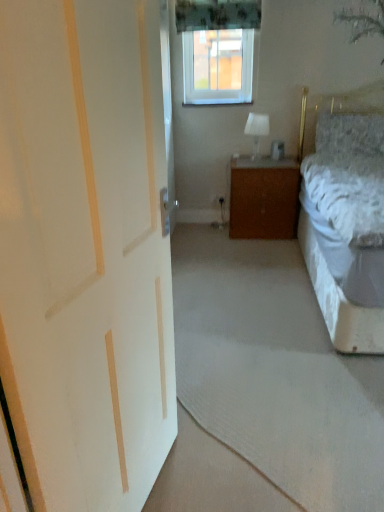
Describe the element at coordinates (217, 14) in the screenshot. This screenshot has width=384, height=512. I see `green floral fabric curtain at upper center` at that location.

Where is `wooden cabinet at center`? wooden cabinet at center is located at coordinates (264, 198).

How many degrees apart are the facing directions of white painted wood door at left and wooden cabinet at center?

They differ by 75.7 degrees in their facing directions.

Choose the correct answer: Is white painted wood door at left inside wooden cabinet at center or outside it?

white painted wood door at left is located beyond the bounds of wooden cabinet at center.

From a real-world perspective, which object stands above the other?

white painted wood door at left is physically above.

How distant is white painted wood door at left from wooden cabinet at center?

white painted wood door at left is 7.90 feet from wooden cabinet at center.

From the image's perspective, relative to white fabric lampshade at upper center, is fluffy gray pillow at upper right above or below?

fluffy gray pillow at upper right is above white fabric lampshade at upper center.

Is fluffy gray pillow at upper right not inside white fabric lampshade at upper center?

fluffy gray pillow at upper right is positioned outside white fabric lampshade at upper center.

Where is `pillow in front of the white fabric lampshade at upper center`? Image resolution: width=384 pixels, height=512 pixels. pillow in front of the white fabric lampshade at upper center is located at coordinates (350, 134).

From a real-world perspective, is fluffy gray pillow at upper right beneath white fabric lampshade at upper center?

No, from a real-world perspective, fluffy gray pillow at upper right is not beneath white fabric lampshade at upper center.

Is fluffy gray pillow at upper right to the right of green floral fabric curtain at upper center from the viewer's perspective?

Yes, fluffy gray pillow at upper right is to the right of green floral fabric curtain at upper center.

From a real-world perspective, is fluffy gray pillow at upper right located beneath green floral fabric curtain at upper center?

Correct, in the physical world, fluffy gray pillow at upper right is lower than green floral fabric curtain at upper center.

The height and width of the screenshot is (512, 384). In the image, there is a green floral fabric curtain at upper center. What are the coordinates of `pillow below it (from a real-world perspective)` in the screenshot? It's located at (350, 134).

How many degrees apart are the facing directions of white painted wood door at left and green floral fabric curtain at upper center?

The angular difference between white painted wood door at left and green floral fabric curtain at upper center is 74.9 degrees.

I want to click on door below the green floral fabric curtain at upper center (from a real-world perspective), so click(x=85, y=250).

Considering the sizes of objects white painted wood door at left and green floral fabric curtain at upper center in the image provided, who is taller, white painted wood door at left or green floral fabric curtain at upper center?

white painted wood door at left.

Considering the relative sizes of white painted wood door at left and green floral fabric curtain at upper center in the image provided, is white painted wood door at left wider than green floral fabric curtain at upper center?

Yes.

Is fluffy gray pillow at upper right touching wooden cabinet at center?

fluffy gray pillow at upper right and wooden cabinet at center are clearly separated.

From a real-world perspective, between fluffy gray pillow at upper right and wooden cabinet at center, who is vertically higher?

fluffy gray pillow at upper right.

Which object is wider, fluffy gray pillow at upper right or wooden cabinet at center?

wooden cabinet at center is wider.

Which of these two, fluffy gray pillow at upper right or wooden cabinet at center, stands shorter?

fluffy gray pillow at upper right.

Can you confirm if white fabric lampshade at upper center is taller than clear plastic window screen at upper center?

Incorrect, the height of white fabric lampshade at upper center is not larger of that of clear plastic window screen at upper center.

Does white fabric lampshade at upper center contain clear plastic window screen at upper center?

No, clear plastic window screen at upper center is not surrounded by white fabric lampshade at upper center.

Looking at the image, does white fabric lampshade at upper center seem bigger or smaller compared to clear plastic window screen at upper center?

Clearly, white fabric lampshade at upper center is smaller in size than clear plastic window screen at upper center.

In the scene shown: From the image's perspective, is white fabric lampshade at upper center above clear plastic window screen at upper center?

Actually, white fabric lampshade at upper center appears below clear plastic window screen at upper center in the image.

Is wooden cabinet at center at the left side of clear plastic window screen at upper center?

No, wooden cabinet at center is not to the left of clear plastic window screen at upper center.

Is point (284, 207) behind point (221, 77)?

No, (284, 207) is in front of (221, 77).

Is clear plastic window screen at upper center a part of wooden cabinet at center?

No, clear plastic window screen at upper center is not inside wooden cabinet at center.

In order to click on door on the left of wooden cabinet at center in this screenshot , I will do `click(85, 250)`.

This screenshot has height=512, width=384. Identify the location of lamp lying behind the fluffy gray pillow at upper right. (257, 130).

Looking at the image, which one is located further to white fabric lampshade at upper center, white painted wood door at left or wooden cabinet at center?

Among the two, white painted wood door at left is located further to white fabric lampshade at upper center.

Estimate the real-world distances between objects in this image. Which object is closer to fluffy gray pillow at upper right, green floral fabric curtain at upper center or wooden cabinet at center?

Among the two, wooden cabinet at center is located nearer to fluffy gray pillow at upper right.

Considering their positions, is white painted wood door at left positioned further to green floral fabric curtain at upper center than wooden cabinet at center?

white painted wood door at left lies further to green floral fabric curtain at upper center than the other object.

Looking at the image, which one is located further to white painted wood door at left, clear plastic window screen at upper center or fluffy gray pillow at upper right?

clear plastic window screen at upper center is positioned further to the anchor white painted wood door at left.

Considering their positions, is white painted wood door at left positioned further to green floral fabric curtain at upper center than white fabric lampshade at upper center?

white painted wood door at left is positioned further to the anchor green floral fabric curtain at upper center.

Based on their spatial positions, is white fabric lampshade at upper center or white painted wood door at left closer to green floral fabric curtain at upper center?

white fabric lampshade at upper center is positioned closer to the anchor green floral fabric curtain at upper center.

Which object lies further to the anchor point white painted wood door at left, wooden cabinet at center or white fabric lampshade at upper center?

white fabric lampshade at upper center is positioned further to the anchor white painted wood door at left.

Looking at the image, which one is located closer to clear plastic window screen at upper center, wooden cabinet at center or fluffy gray pillow at upper right?

fluffy gray pillow at upper right lies closer to clear plastic window screen at upper center than the other object.

Identify the location of pillow between green floral fabric curtain at upper center and wooden cabinet at center from top to bottom. (350, 134).

This screenshot has height=512, width=384. Find the location of `pillow between white painted wood door at left and clear plastic window screen at upper center along the z-axis`. pillow between white painted wood door at left and clear plastic window screen at upper center along the z-axis is located at coordinates (350, 134).

Locate an element on the screen. lamp between green floral fabric curtain at upper center and wooden cabinet at center in the vertical direction is located at coordinates (257, 130).

Locate an element on the screen. pillow that lies between clear plastic window screen at upper center and wooden cabinet at center from top to bottom is located at coordinates (350, 134).